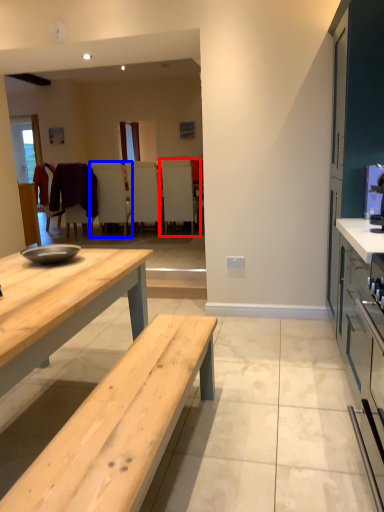
Question: Which object appears closest to the camera in this image, chair (highlighted by a red box) or chair (highlighted by a blue box)?

Choices:
 (A) chair
 (B) chair

Answer: (A)